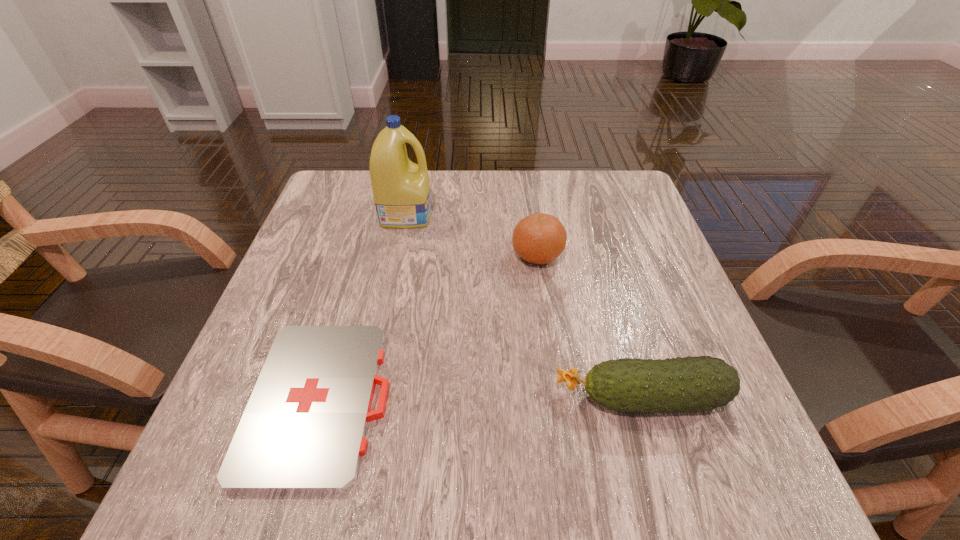
Where is `free space that is in between the clementine and the tallest object`? This screenshot has width=960, height=540. free space that is in between the clementine and the tallest object is located at coordinates (471, 234).

Identify which object is located as the second nearest to the shortest object. Please provide its 2D coordinates. Your answer should be formatted as a tuple, i.e. [(x, y)], where the tuple contains the x and y coordinates of a point satisfying the conditions above.

[(702, 383)]

Identify which object is the closest to the third tallest object. Please provide its 2D coordinates. Your answer should be formatted as a tuple, i.e. [(x, y)], where the tuple contains the x and y coordinates of a point satisfying the conditions above.

[(540, 238)]

At what (x,y) coordinates should I click in order to perform the action: click on vacant region that satisfies the following two spatial constraints: 1. on the label of the clementine; 2. on the right side of the farthest object. Please return your answer as a coordinate pair (x, y). Looking at the image, I should click on (397, 255).

Locate an element on the screen. vacant region that satisfies the following two spatial constraints: 1. on the label of the third nearest object; 2. on the left side of the tallest object is located at coordinates (397, 255).